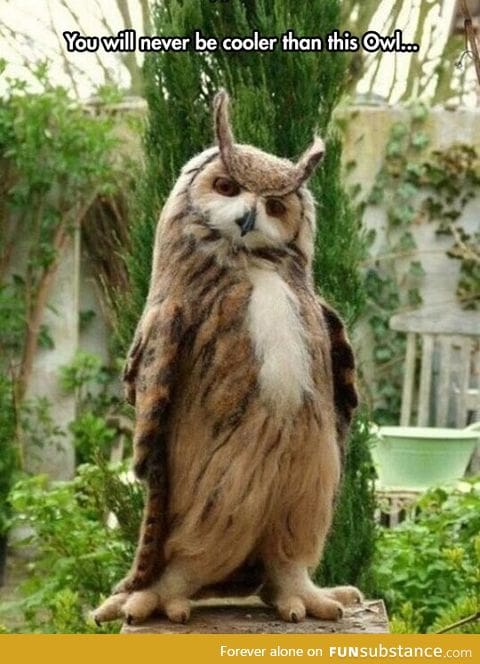
The width and height of the screenshot is (480, 664). I want to click on table, so click(x=237, y=619).